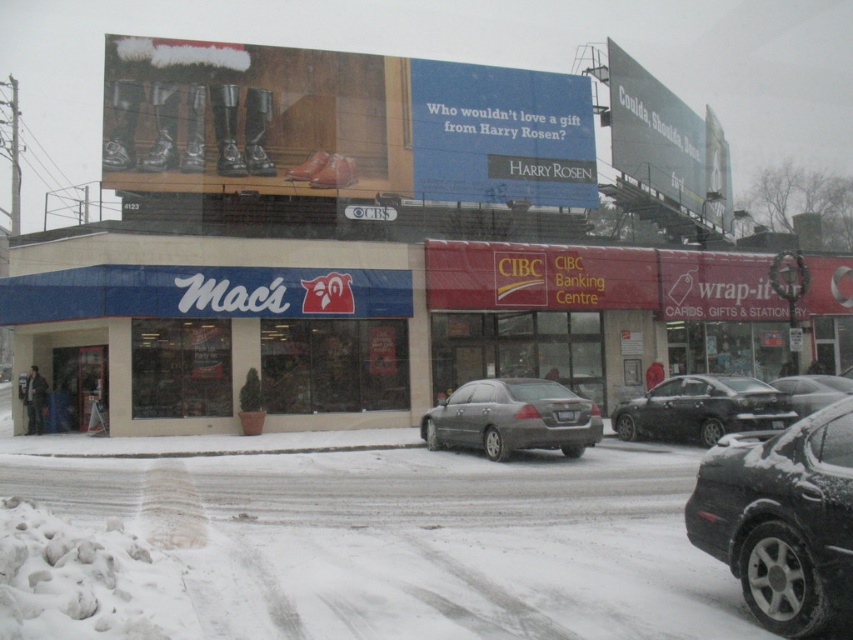
Question: Is shiny black sedan at center in front of metallic silver sedan at center?

Choices:
 (A) yes
 (B) no

Answer: (B)

Question: Among these objects, which one is nearest to the camera?

Choices:
 (A) shiny black sedan at center
 (B) matte gray sedan at center
 (C) metallic silver sedan at center
 (D) shiny black sedan at lower right

Answer: (D)

Question: Does matte gray sedan at center have a smaller size compared to metallic silver sedan at center?

Choices:
 (A) no
 (B) yes

Answer: (B)

Question: Estimate the real-world distances between objects in this image. Which object is farther from the shiny black sedan at center?

Choices:
 (A) shiny black sedan at lower right
 (B) matte gray sedan at center
 (C) metallic silver sedan at center

Answer: (A)

Question: Can you confirm if shiny black sedan at center is smaller than metallic silver sedan at center?

Choices:
 (A) yes
 (B) no

Answer: (A)

Question: Which is nearer to the matte gray sedan at center?

Choices:
 (A) shiny black sedan at lower right
 (B) shiny black sedan at center
 (C) metallic silver sedan at center

Answer: (B)